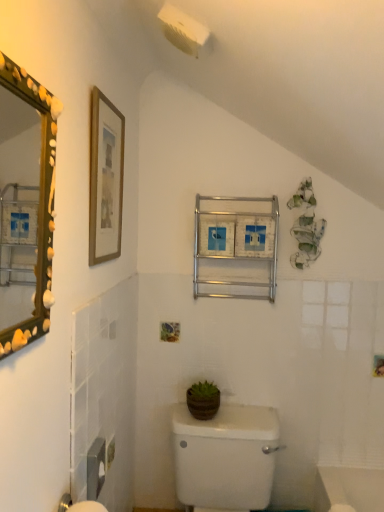
The width and height of the screenshot is (384, 512). I want to click on vacant space underneath metallic silver medicine cabinet at center (from a real-world perspective), so click(x=251, y=410).